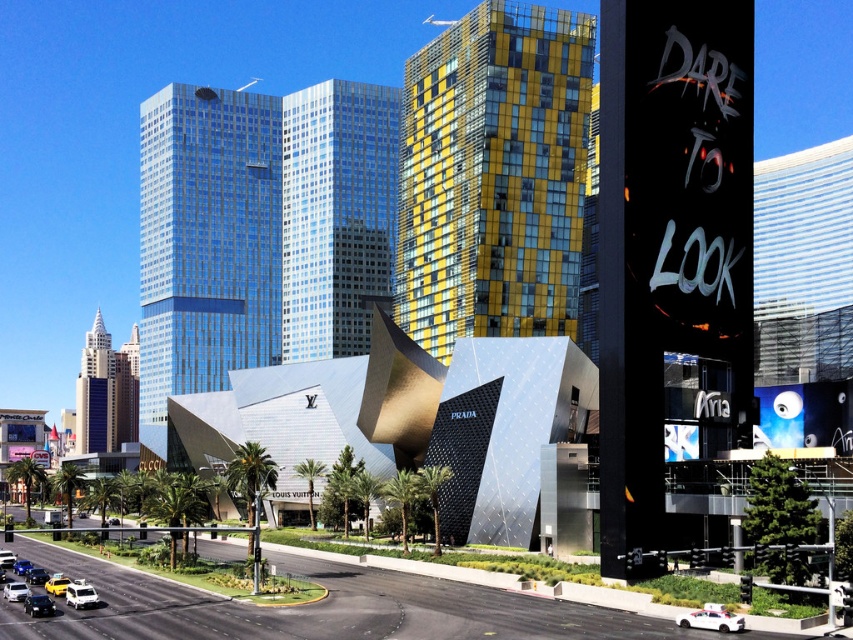
You are a photographer positioned at the intersection and want to capture both the yellow glass building at center and the shiny black sedan at lower left in a single frame. Based on their positions, which object should you adjust your camera angle to focus on first to ensure both are in the shot?

A: The yellow glass building at center is to the right of the shiny black sedan at lower left, so you should first focus on the sedan to frame the building on its right side.